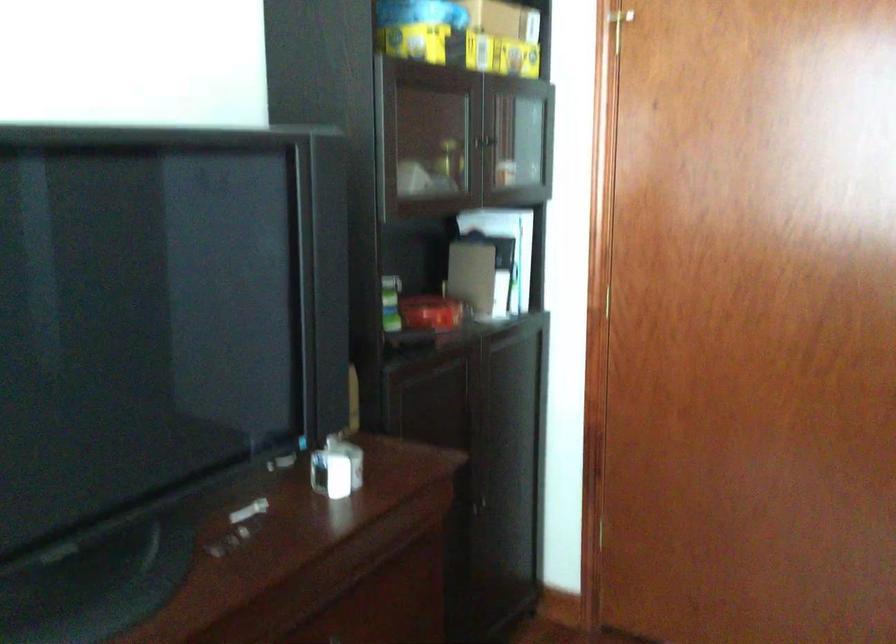
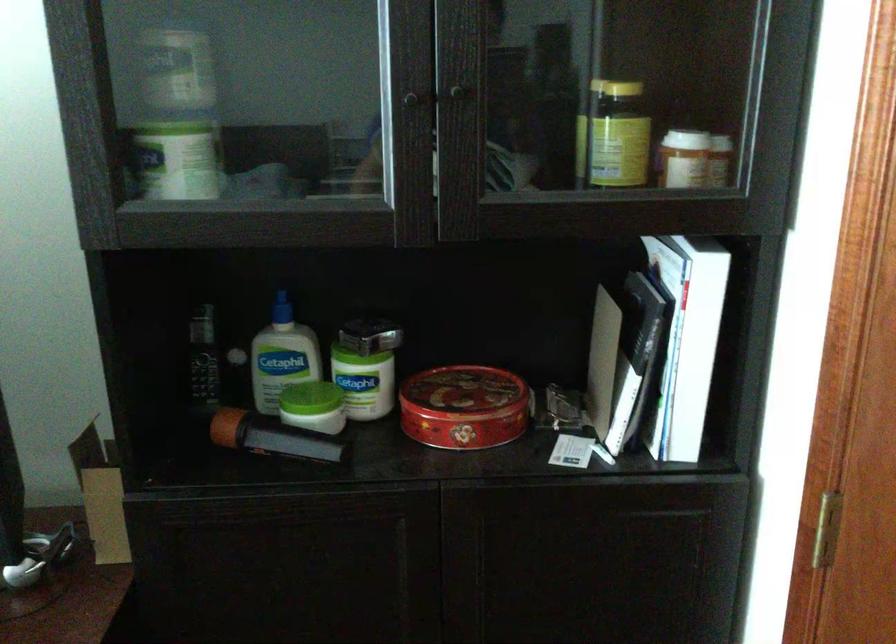
Where in the second image is the point corresponding to the point at 513,158 from the first image?

(686, 135)